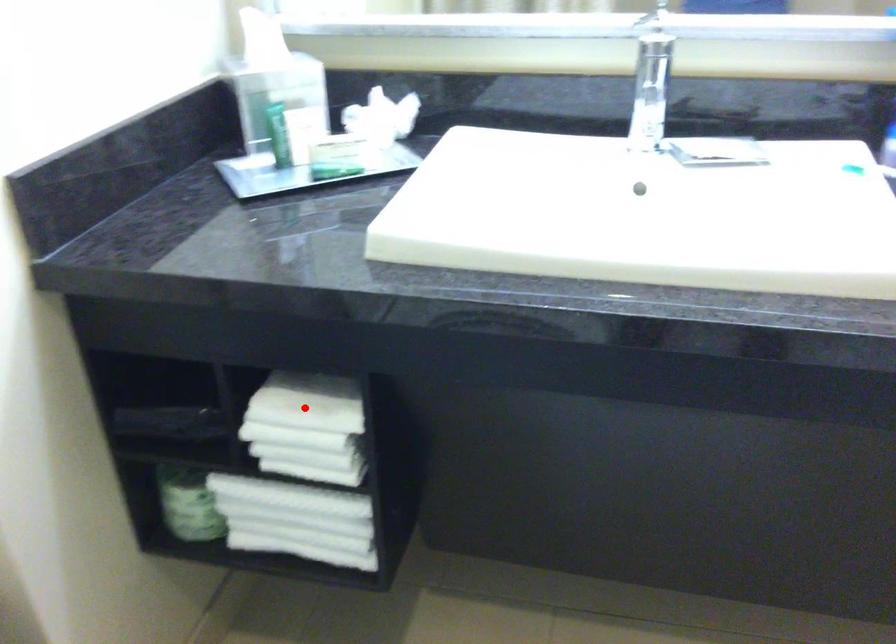
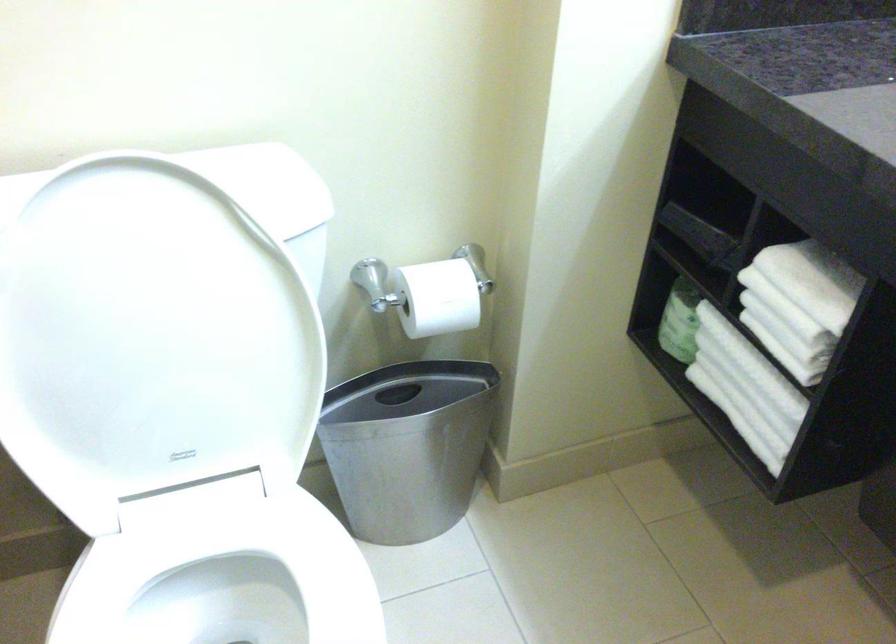
Where in the second image is the point corresponding to the highlighted location from the first image?

(806, 281)